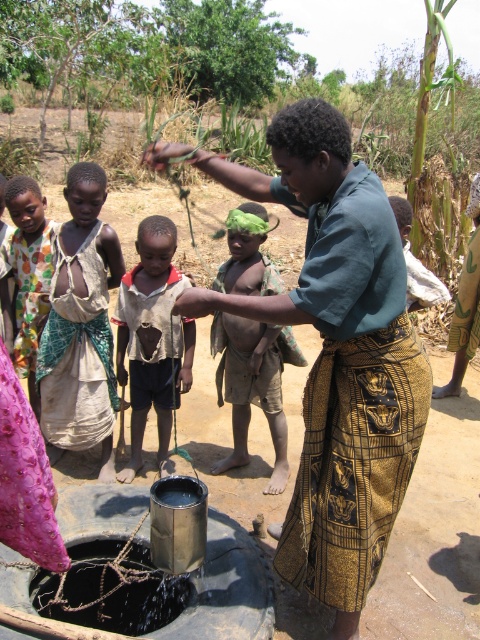
You are standing at the well in the rural outdoor scene. There are two points marked on the ground around the well. The first point is at coordinate point (379, 244) and the second point is at coordinate point (115, 316). If you want to walk from the first point to the second point, which direction should you move relative to your current position?

You should move backward because point (379, 244) is in front of point (115, 316), meaning the second point is behind your current position.

In the rural outdoor scene with the well, there is a light brown fabric dress at center and a polka dot fabric shirt at left. Which clothing item is positioned to the right of the other?

The light brown fabric dress at center is to the right of the polka dot fabric shirt at left.